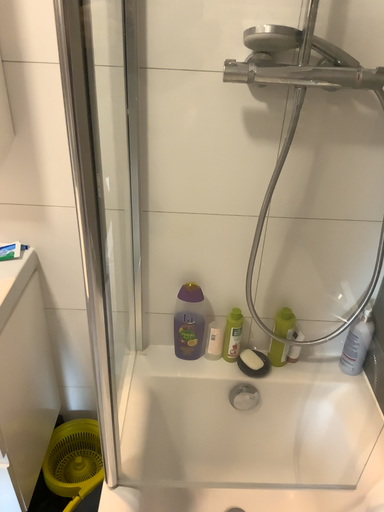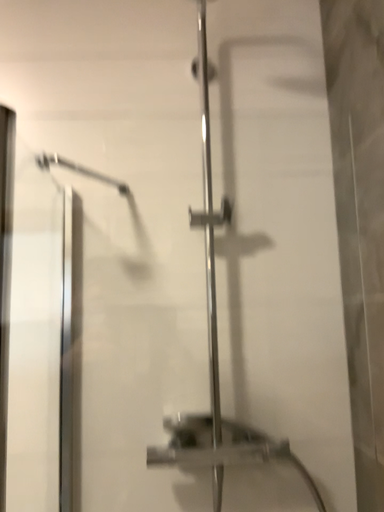
Question: Which way did the camera rotate in the video?

Choices:
 (A) rotated upward
 (B) rotated downward

Answer: (A)